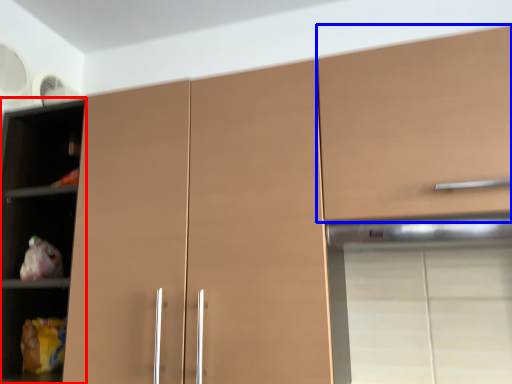
Question: Among these objects, which one is farthest to the camera, cupboard (highlighted by a red box) or cabinetry (highlighted by a blue box)?

Choices:
 (A) cupboard
 (B) cabinetry

Answer: (A)